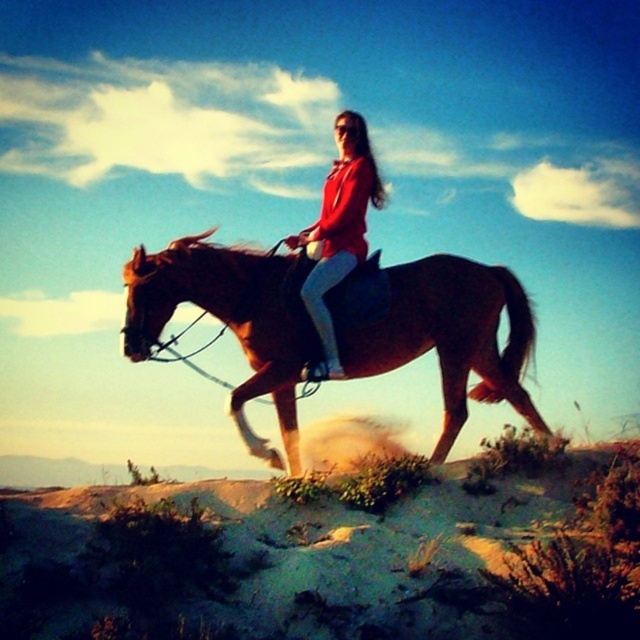
Question: Does brown glossy horse at center have a smaller size compared to matte red jacket at center?

Choices:
 (A) yes
 (B) no

Answer: (A)

Question: Does brown glossy horse at center appear on the right side of matte red jacket at center?

Choices:
 (A) yes
 (B) no

Answer: (A)

Question: Is brown glossy horse at center above matte red jacket at center?

Choices:
 (A) yes
 (B) no

Answer: (B)